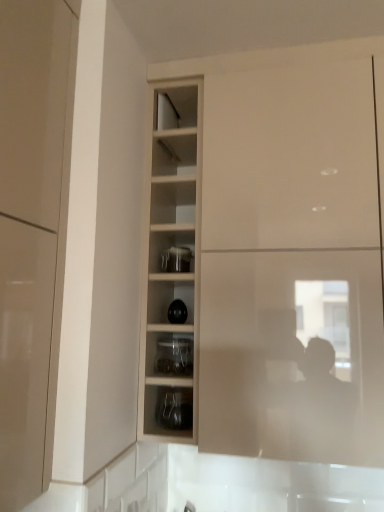
Question: Is wooden shelves at center in front of or behind transparent glass jar at center in the image?

Choices:
 (A) behind
 (B) front

Answer: (B)

Question: Would you say wooden shelves at center is inside or outside transparent glass jar at center?

Choices:
 (A) outside
 (B) inside

Answer: (A)

Question: Which is farther from the clear glass jar at center, placed as the first shelf when sorted from top to bottom?

Choices:
 (A) glossy beige cabinet at left, acting as the 1th cabinetry starting from the left
 (B) matte white cabinet at center, which is the 2th cabinetry in front-to-back order
 (C) matte black jar at center, the second shelf positioned from the top
 (D) transparent glass jar at center
 (E) wooden shelves at center

Answer: (A)

Question: Considering the real-world distances, which object is closest to the matte black jar at center, the second shelf positioned from the top?

Choices:
 (A) transparent glass jar at center
 (B) clear glass jar at center, marked as the second shelf in a bottom-to-top arrangement
 (C) matte white cabinet at center, marked as the first cabinetry in a back-to-front arrangement
 (D) wooden shelves at center
 (E) glossy beige cabinet at left, the 2th cabinetry in the back-to-front sequence

Answer: (B)